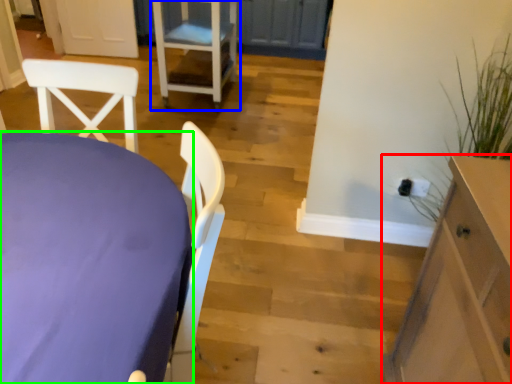
Question: Which object is positioned closest to cabinetry (highlighted by a red box)? Select from chair (highlighted by a blue box) and table (highlighted by a green box).

Choices:
 (A) chair
 (B) table

Answer: (B)